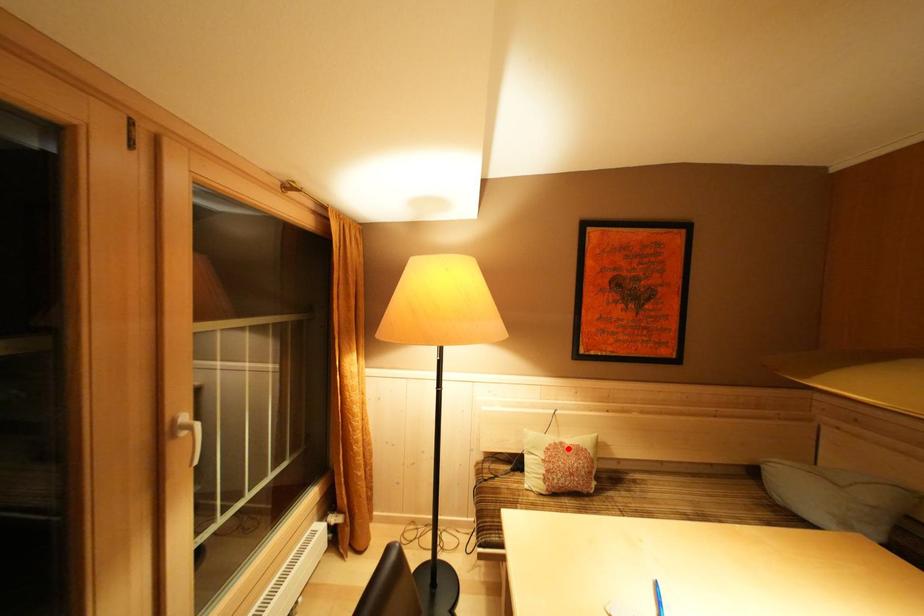
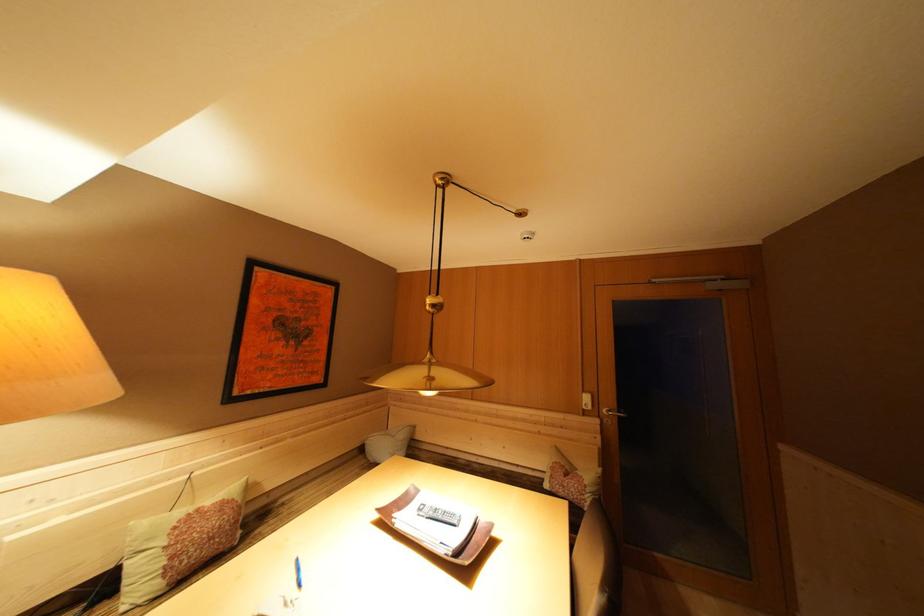
Locate, in the second image, the point that corresponds to the highlighted location in the first image.

(204, 515)